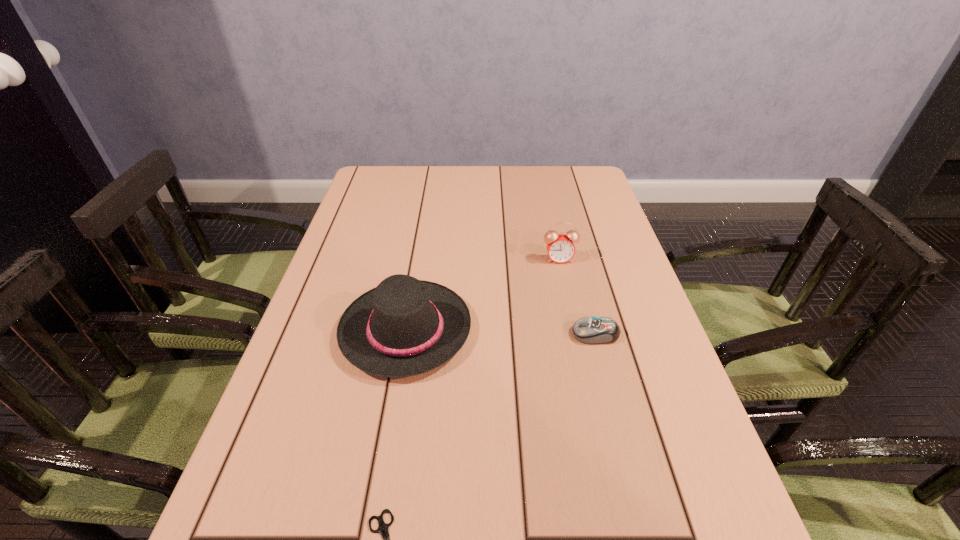
Locate an element on the screen. The height and width of the screenshot is (540, 960). computer mouse located in the right edge section of the desktop is located at coordinates (590, 330).

At what (x,y) coordinates should I click in order to perform the action: click on free region at the far edge. Please return your answer as a coordinate pair (x, y). The width and height of the screenshot is (960, 540). Looking at the image, I should click on (538, 198).

You are a GUI agent. You are given a task and a screenshot of the screen. Output one action in this format:
    pyautogui.click(x=<x>, y=<y>)
    Task: Click on the vacant space at the left edge of the desktop
    This screenshot has width=960, height=540.
    Given the screenshot: What is the action you would take?
    coord(362,224)

I want to click on free space at the right edge of the desktop, so click(x=585, y=246).

This screenshot has width=960, height=540. Find the location of `vacant space at the far left corner of the desktop`. vacant space at the far left corner of the desktop is located at coordinates (375, 183).

Locate an element on the screen. free space between the computer mouse and the dress hat is located at coordinates (500, 332).

Locate an element on the screen. vacant area that lies between the alarm clock and the dress hat is located at coordinates click(x=482, y=294).

Where is `free space that is in between the dress hat and the computer mouse`? Image resolution: width=960 pixels, height=540 pixels. free space that is in between the dress hat and the computer mouse is located at coordinates (500, 332).

Identify which object is the third nearest to the farthest object. Please provide its 2D coordinates. Your answer should be formatted as a tuple, i.e. [(x, y)], where the tuple contains the x and y coordinates of a point satisfying the conditions above.

[(383, 527)]

Find the location of `object that is the closest to the farthest object`. object that is the closest to the farthest object is located at coordinates point(404,327).